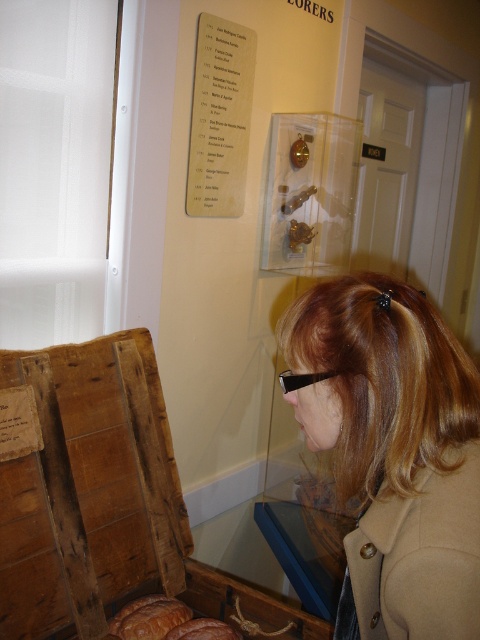
You are an artist trying to sketch the scene. You need to decide the order to draw elements based on their size. Which should you draw first, the light brown hair at center or the wooden crate at lower left?

The wooden crate at lower left should be drawn first because it is wider than the light brown hair at center, so it requires more space and attention in the sketch.